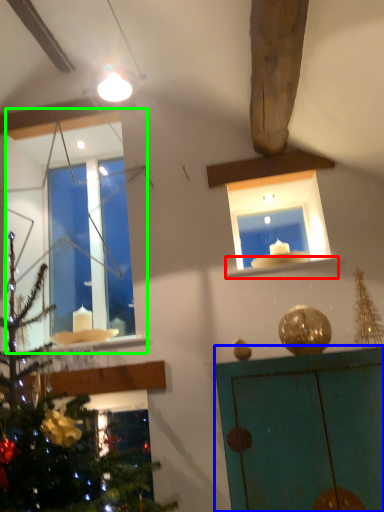
Question: Considering the real-world distances, which object is closest to window sill (highlighted by a red box)? furniture (highlighted by a blue box) or window (highlighted by a green box).

Choices:
 (A) furniture
 (B) window

Answer: (A)